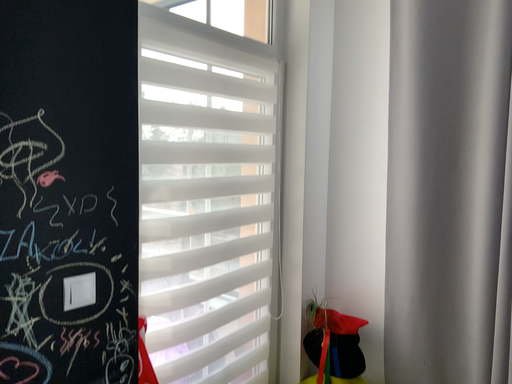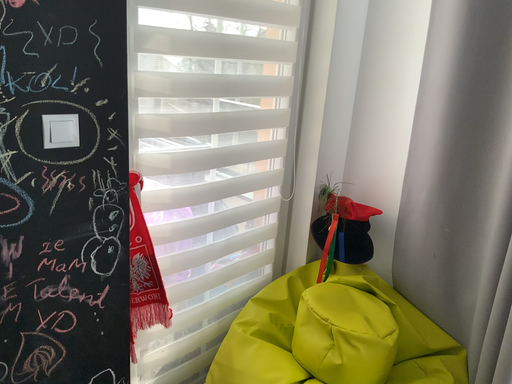
Question: How did the camera likely rotate when shooting the video?

Choices:
 (A) rotated left
 (B) rotated right

Answer: (A)